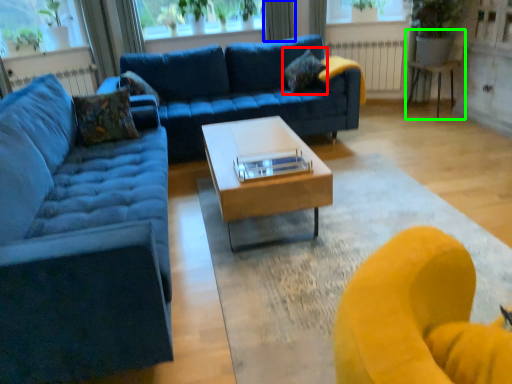
Question: Based on their relative distances, which object is farther from pillow (highlighted by a red box)? Choose from curtain (highlighted by a blue box) and swivel chair (highlighted by a green box).

Choices:
 (A) curtain
 (B) swivel chair

Answer: (A)